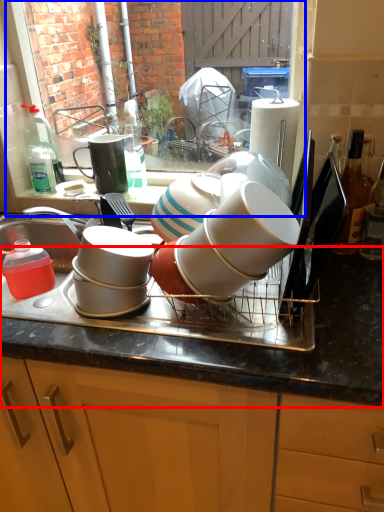
Question: Among these objects, which one is farthest to the camera, countertop (highlighted by a red box) or window (highlighted by a blue box)?

Choices:
 (A) countertop
 (B) window

Answer: (B)